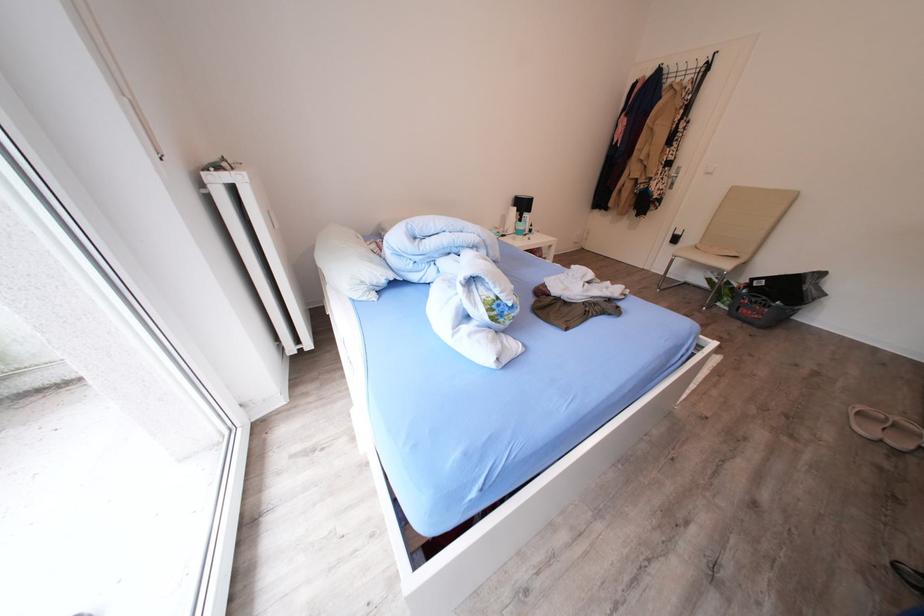
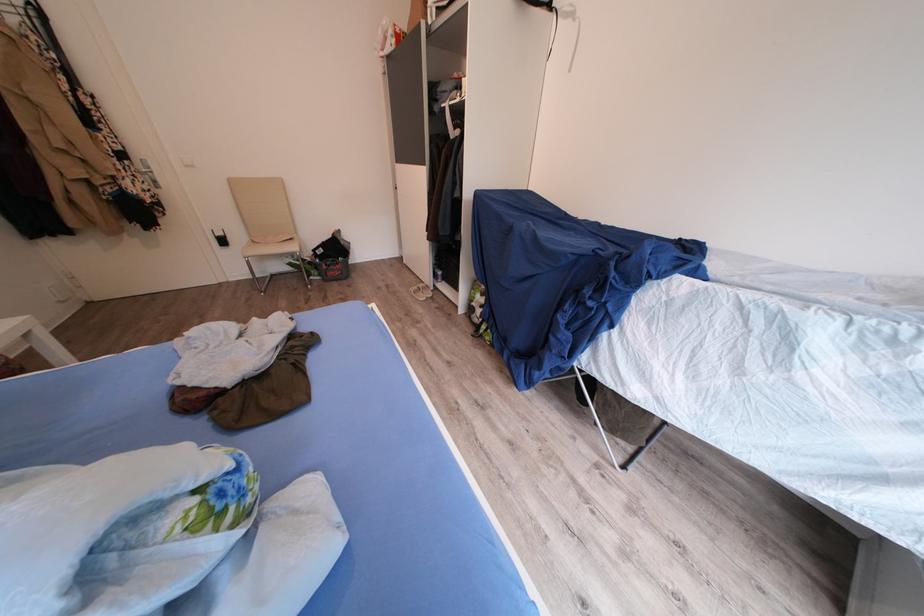
The first image is from the beginning of the video and the second image is from the end. How did the camera likely rotate when shooting the video?

The camera's rotation is toward right-down.